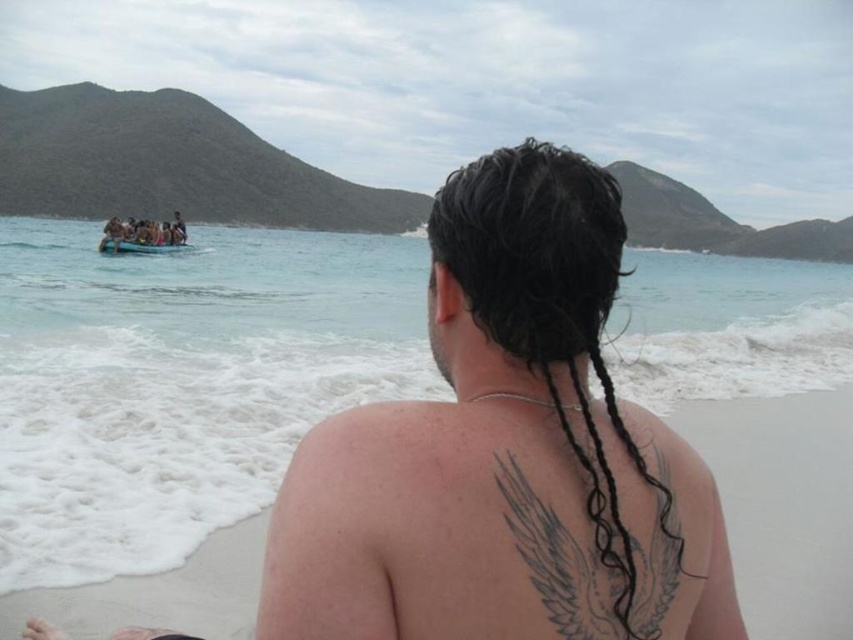
You are a photographer trying to capture the person in the scene. You need to ensure both the dark hair at center and the gray ink wings at back are visible in your shot. Based on their positions, which side of the person should you position yourself to get both objects in frame?

To capture both the dark hair at center and the gray ink wings at back in your shot, you should position yourself to the left side of the person. This is because the dark hair at center is to the left of the gray ink wings at back, so positioning yourself left allows both objects to be within the frame.

You are a photographer trying to capture the person in the scene. Which object, the clear blue water at center or the dark hair at center, is positioned higher in the frame?

The clear blue water at center is taller than the dark hair at center, so it is positioned higher in the frame.